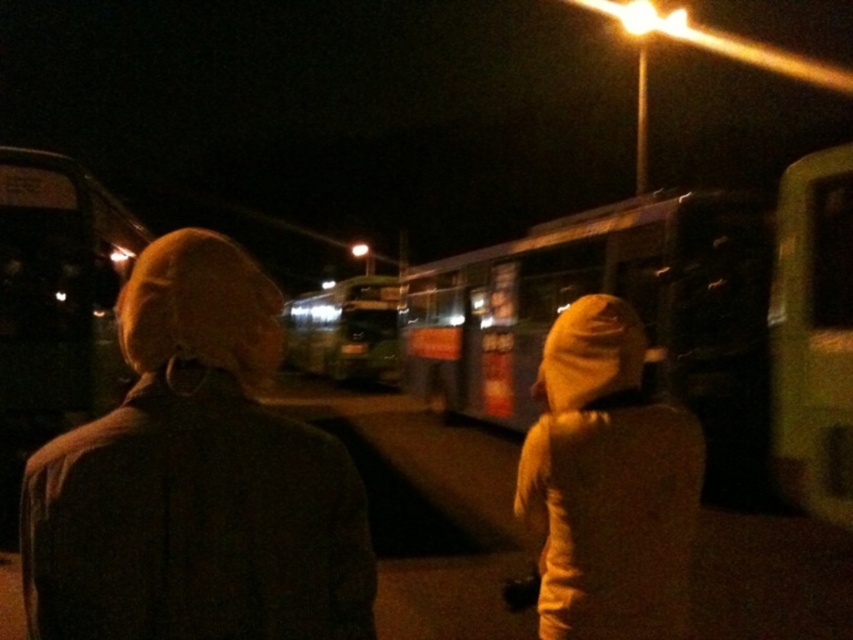
Question: Observing the image, what is the correct spatial positioning of metallic bus at left in reference to yellow-green plastic bus at right?

Choices:
 (A) left
 (B) right

Answer: (A)

Question: Is metallic silver bus at center further to the viewer compared to yellow fleece jacket at center?

Choices:
 (A) no
 (B) yes

Answer: (B)

Question: Does metallic bus at left appear on the right side of metallic green bus at center?

Choices:
 (A) yes
 (B) no

Answer: (A)

Question: Among these points, which one is farthest from the camera?

Choices:
 (A) (798, 173)
 (B) (68, 186)

Answer: (B)

Question: Which point is farther to the camera?

Choices:
 (A) yellow fleece jacket at center
 (B) brown woolen hat at upper left
 (C) metallic bus at left

Answer: (C)

Question: Which point appears farthest from the camera in this image?

Choices:
 (A) (434, 344)
 (B) (212, 292)
 (C) (567, 541)

Answer: (A)